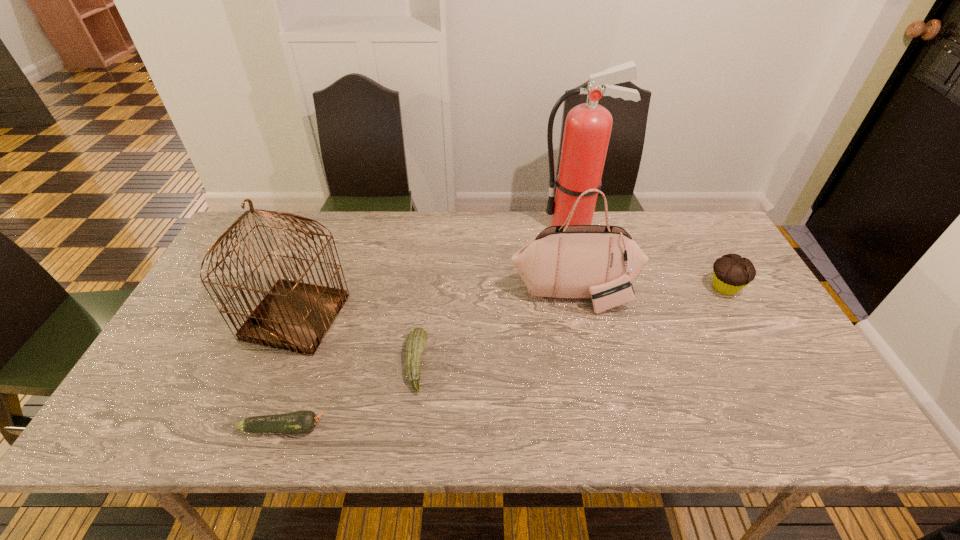
Identify the location of unoccupied area between the birdcage and the rightmost object. The image size is (960, 540). (511, 302).

Where is `free space between the birdcage and the left zucchini`? Image resolution: width=960 pixels, height=540 pixels. free space between the birdcage and the left zucchini is located at coordinates (290, 373).

You are a GUI agent. You are given a task and a screenshot of the screen. Output one action in this format:
    pyautogui.click(x=<x>, y=<y>)
    Task: Click on the vacant space that is in between the farther zucchini and the rightmost object
    
    Given the screenshot: What is the action you would take?
    pyautogui.click(x=570, y=326)

Image resolution: width=960 pixels, height=540 pixels. In order to click on unoccupied area between the birdcage and the handbag in this screenshot , I will do `click(435, 306)`.

The height and width of the screenshot is (540, 960). Find the location of `free spot between the birdcage and the tallest object`. free spot between the birdcage and the tallest object is located at coordinates (434, 271).

Identify which object is the fourth nearest to the fourth object from right to left. Please provide its 2D coordinates. Your answer should be formatted as a tuple, i.e. [(x, y)], where the tuple contains the x and y coordinates of a point satisfying the conditions above.

[(588, 126)]

Locate an element on the screen. The image size is (960, 540). object that can be found as the third closest to the nearest object is located at coordinates click(600, 262).

Locate an element on the screen. The height and width of the screenshot is (540, 960). free region that satisfies the following two spatial constraints: 1. on the side of the handbag with the attached pouch; 2. at the stem end of the fourth object from right to left is located at coordinates (589, 363).

You are a GUI agent. You are given a task and a screenshot of the screen. Output one action in this format:
    pyautogui.click(x=<x>, y=<y>)
    Task: Click on the vacant space that satisfies the following two spatial constraints: 1. on the hose direction of the tallest object; 2. on the right side of the fourth tallest object
    The image size is (960, 540).
    Given the screenshot: What is the action you would take?
    pyautogui.click(x=588, y=288)

Identify the location of vacant space that satisfies the following two spatial constraints: 1. on the hose direction of the muffin; 2. on the right side of the tallest object. The image size is (960, 540). (588, 288).